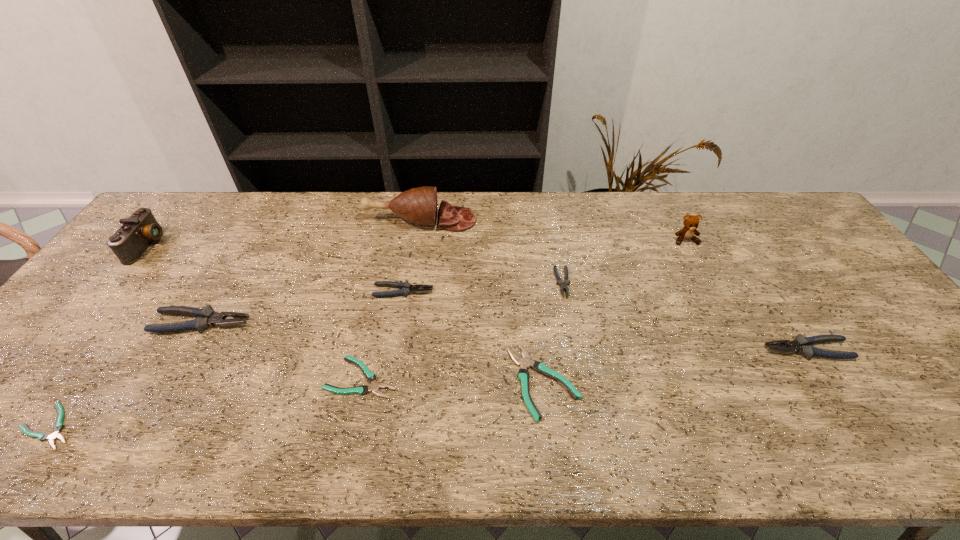
This screenshot has width=960, height=540. In order to click on free location located at the gripping part of the third object from left to right in this screenshot , I will do `click(345, 323)`.

Where is `free region located 0.210m at the gripping part of the nearest gray pliers`? free region located 0.210m at the gripping part of the nearest gray pliers is located at coordinates click(681, 349).

In order to click on vacant area situated at the gripping part of the nearest gray pliers in this screenshot , I will do `click(620, 349)`.

At what (x,y) coordinates should I click in order to perform the action: click on vacant area located 0.310m at the gripping part of the nearest gray pliers. Please return your answer as a coordinate pair (x, y). This screenshot has width=960, height=540. Looking at the image, I should click on (640, 349).

At what (x,y) coordinates should I click in order to perform the action: click on vacant region located 0.090m at the gripping part of the third tallest pliers. Please return your answer as a coordinate pair (x, y). The image size is (960, 540). Looking at the image, I should click on (465, 292).

Identify the location of vacant area situated at the gripping part of the second gray pliers from right to left. (589, 429).

This screenshot has width=960, height=540. What are the coordinates of `vacant region located 0.150m on the right of the rightmost teal pliers` in the screenshot? It's located at (642, 381).

Locate an element on the screen. The image size is (960, 540). vacant area situated on the front of the second biggest teal pliers is located at coordinates (346, 451).

In order to click on free location located 0.280m on the back of the shortest object in this screenshot , I will do `click(135, 309)`.

Identify the location of ham at the far edge. (419, 205).